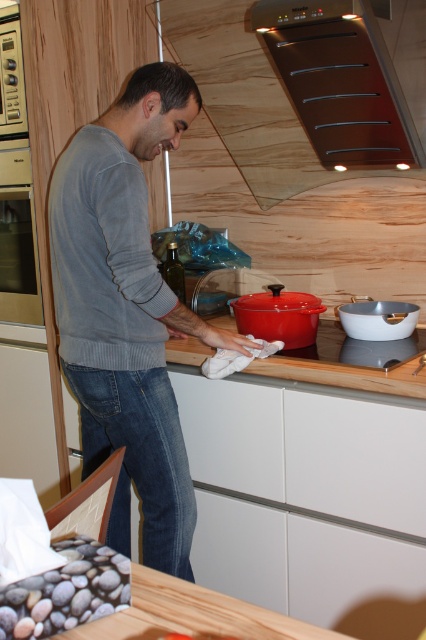
You are a kitchen designer planning to install a new spice rack between the brushed metal exhaust hood at upper center and the wooden cutting board at center. Given that the spice rack requires 30 inches of space, will there be enough space between them?

The distance between the brushed metal exhaust hood at upper center and the wooden cutting board at center is 31.61 inches, which is more than the required 30 inches. Therefore, there is sufficient space to install the spice rack between them.

You are designing a kitchen layout and need to ensure there is enough space between the gray sweater at center and the matte stainless steel oven at left for a service robot to pass through. The robot requires at least 0.5 meters of clearance. Based on the scene description, can the robot navigate between them?

The gray sweater at center has a larger width than the matte stainless steel oven at left. However, the exact distance between them isn t specified in the provided information. To determine if the robot can navigate, you would need to measure the actual space between the two objects to ensure it meets or exceeds the 0.5 meters clearance requirement.